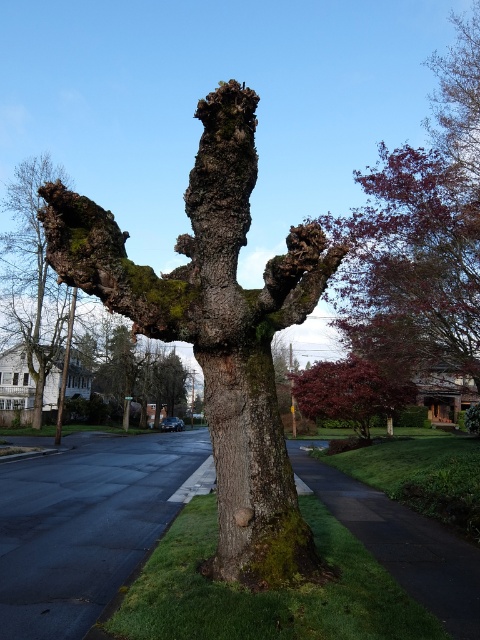
Which is above, green mossy tree trunk at center or green mossy bark at center?

green mossy tree trunk at center is above.

What do you see at coordinates (216, 330) in the screenshot? The image size is (480, 640). I see `green mossy tree trunk at center` at bounding box center [216, 330].

I want to click on green mossy tree trunk at center, so click(x=216, y=330).

Is green mossy bark at left in front of shiny burgundy tree at center?

That is False.

Who is taller, green mossy bark at left or shiny burgundy tree at center?

With more height is green mossy bark at left.

Locate an element on the screen. green mossy bark at left is located at coordinates (32, 275).

This screenshot has width=480, height=640. What are the coordinates of `green mossy bark at left` in the screenshot? It's located at (32, 275).

Who is positioned more to the right, green mossy tree trunk at center or green mossy bark at left?

Positioned to the right is green mossy tree trunk at center.

Which of these two, green mossy tree trunk at center or green mossy bark at left, stands shorter?

green mossy tree trunk at center is shorter.

Where is `green mossy tree trunk at center`? The height and width of the screenshot is (640, 480). green mossy tree trunk at center is located at coordinates (216, 330).